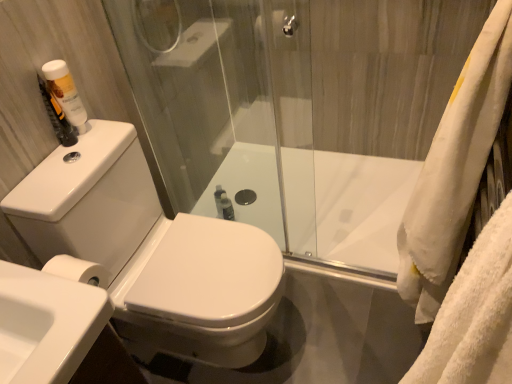
This screenshot has width=512, height=384. I want to click on vacant space that's between white glossy toilet at center and transparent glass shower door at upper right, so click(x=333, y=317).